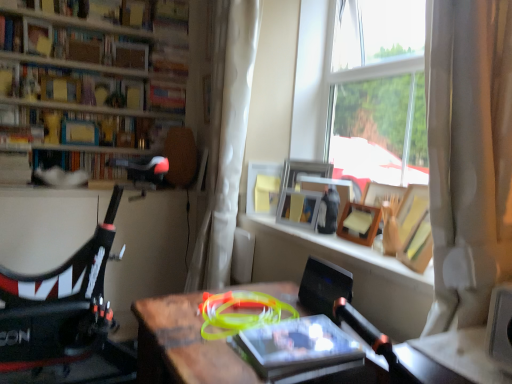
Locate an element on the screen. This screenshot has height=384, width=512. free space in front of wooden picture frame at upper right, which is counted as the third picture frame, starting from the right is located at coordinates (300, 233).